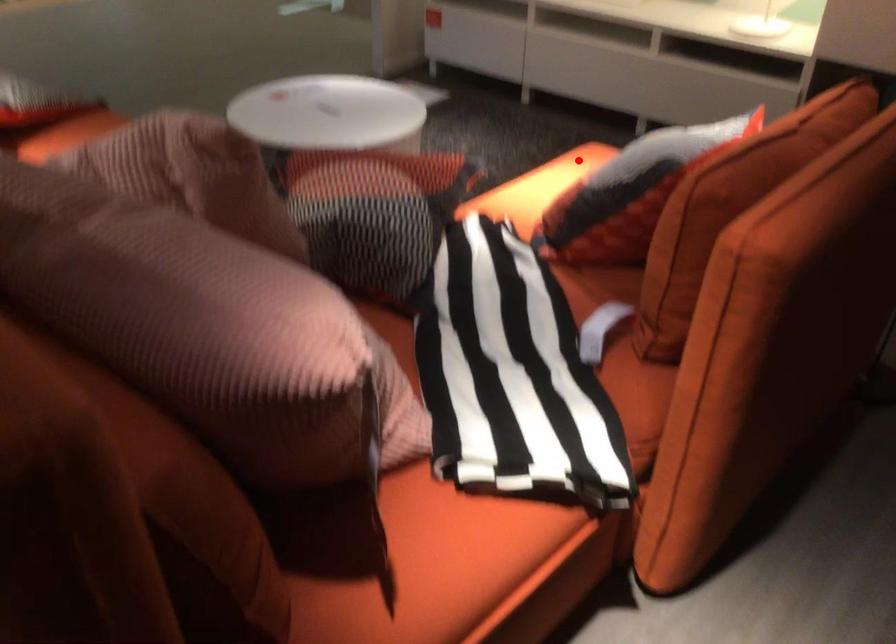
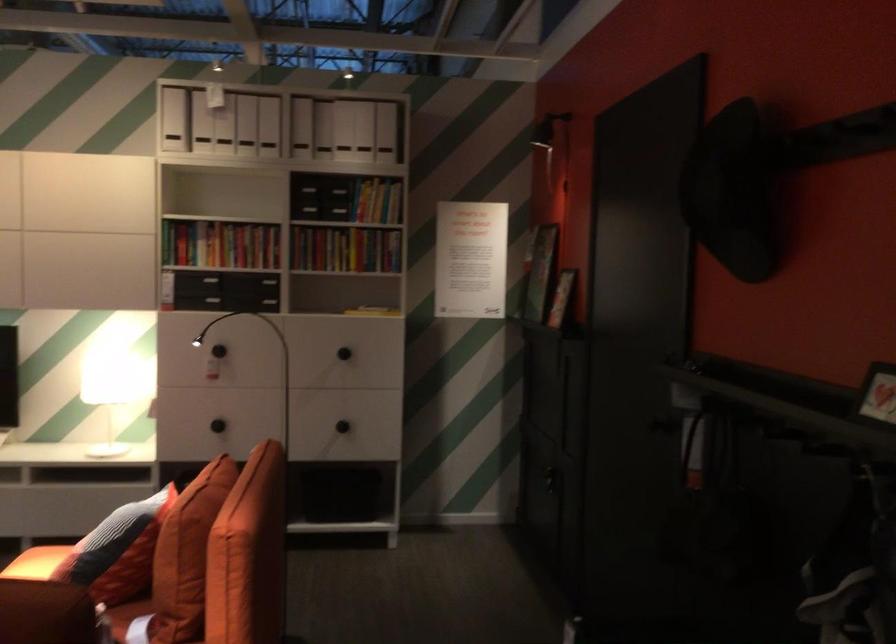
Question: I am providing you with two images of the same scene from different viewpoints. In image1, a red point is highlighted. Considering the same 3D point in image2, which of the following is correct?

Choices:
 (A) It is closer
 (B) It is farther

Answer: (B)